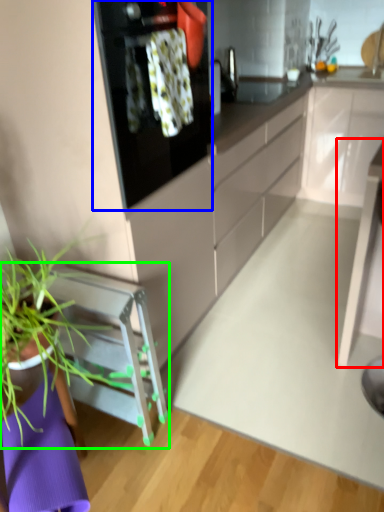
Question: Which object is the farthest from table (highlighted by a red box)? Choose among these: kitchen appliance (highlighted by a blue box) or furniture (highlighted by a green box).

Choices:
 (A) kitchen appliance
 (B) furniture

Answer: (A)